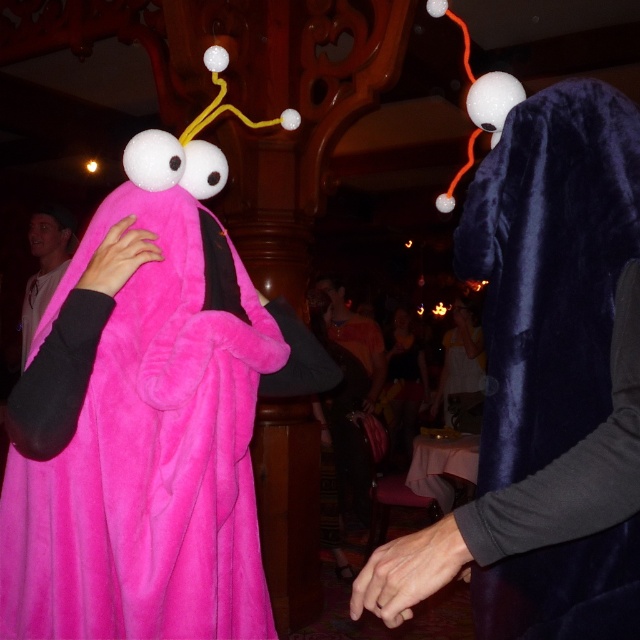
Question: From the image, what is the correct spatial relationship of pink fuzzy costume at left in relation to velvet dark blue robe at right?

Choices:
 (A) below
 (B) above

Answer: (A)

Question: Is velvet dark blue robe at right thinner than velvet fabric dress at center?

Choices:
 (A) yes
 (B) no

Answer: (A)

Question: Which point is closer to the camera taking this photo?

Choices:
 (A) (564, 141)
 (B) (480, 362)

Answer: (A)

Question: Can you confirm if velvet dark blue robe at right is thinner than velvet blue mask at center?

Choices:
 (A) no
 (B) yes

Answer: (B)

Question: Which object is farther from the camera taking this photo?

Choices:
 (A) velvet fabric dress at center
 (B) matte white shirt at left
 (C) velvet dark blue robe at right

Answer: (A)

Question: Which object is closer to the camera taking this photo?

Choices:
 (A) matte white shirt at left
 (B) pink fuzzy costume at left
 (C) velvet fabric dress at center
 (D) velvet blue mask at center

Answer: (B)